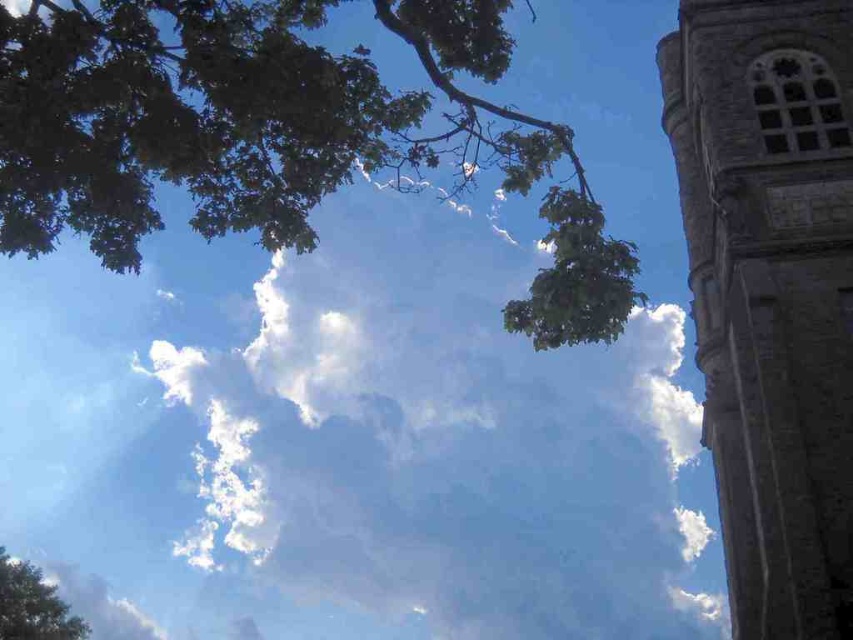
Looking at this image, is green leafy branch at upper left below green leafy tree at lower left?

Incorrect, green leafy branch at upper left is not positioned below green leafy tree at lower left.

The image size is (853, 640). What do you see at coordinates (274, 132) in the screenshot?
I see `green leafy branch at upper left` at bounding box center [274, 132].

Find the location of a particular element. This screenshot has height=640, width=853. green leafy branch at upper left is located at coordinates (274, 132).

Who is more distant from viewer, (325, 74) or (668, 65)?

Result: The point (668, 65) is more distant.

Can you confirm if green leafy branch at upper left is wider than stone tower at right?

Indeed, green leafy branch at upper left has a greater width compared to stone tower at right.

Measure the distance between green leafy branch at upper left and camera.

They are 62.13 feet apart.

Image resolution: width=853 pixels, height=640 pixels. What are the coordinates of `green leafy branch at upper left` in the screenshot? It's located at (274, 132).

Does stone tower at right appear on the left side of green leafy tree at lower left?

In fact, stone tower at right is to the right of green leafy tree at lower left.

Is point (785, 582) farther from viewer compared to point (82, 632)?

That is False.

Is point (828, 349) in front of point (12, 634)?

Yes, point (828, 349) is in front of point (12, 634).

Where is `stone tower at right`? stone tower at right is located at coordinates (770, 292).